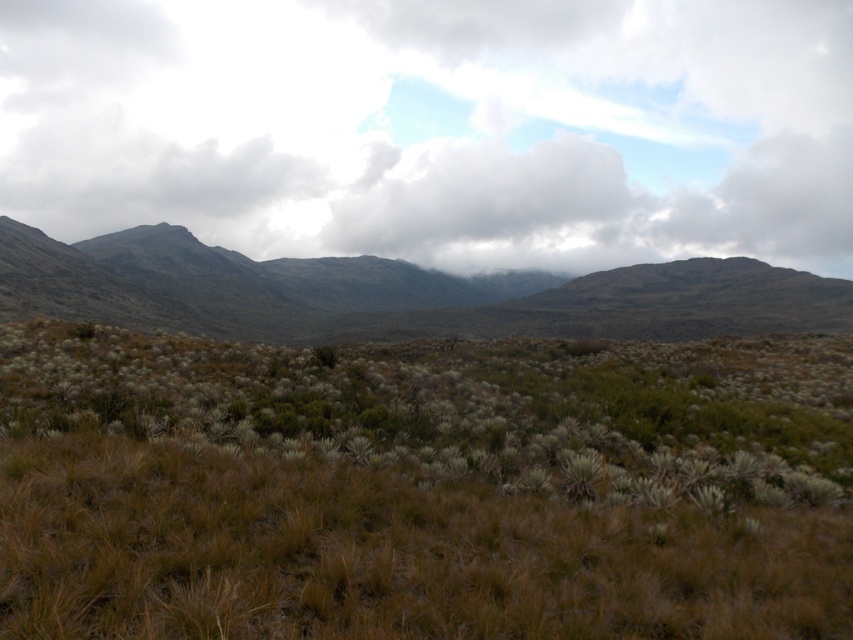
Question: Which object is positioned farthest from the dark gray rocky mountains at center?

Choices:
 (A) brown grassland at center
 (B) cloudy sky at upper center

Answer: (B)

Question: Can you confirm if cloudy sky at upper center is positioned to the left of dark gray rocky mountains at center?

Choices:
 (A) no
 (B) yes

Answer: (A)

Question: Which of the following is the closest to the observer?

Choices:
 (A) (310, 388)
 (B) (314, 269)
 (C) (651, 33)

Answer: (A)

Question: Can you confirm if brown grassland at center is positioned above cloudy sky at upper center?

Choices:
 (A) no
 (B) yes

Answer: (A)

Question: Which object appears farthest from the camera in this image?

Choices:
 (A) brown grassland at center
 (B) cloudy sky at upper center
 (C) dark gray rocky mountains at center

Answer: (B)

Question: Is brown grassland at center to the right of cloudy sky at upper center from the viewer's perspective?

Choices:
 (A) yes
 (B) no

Answer: (B)